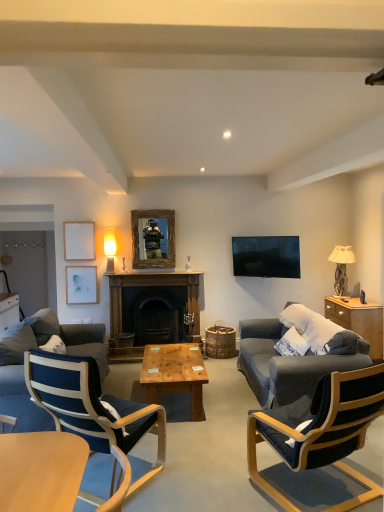
Question: Is dark blue fabric chair at right, the 2th chair positioned from the left, to the left of dark gray fabric couch at left from the viewer's perspective?

Choices:
 (A) yes
 (B) no

Answer: (B)

Question: Can you see dark blue fabric chair at right, the 2th chair positioned from the left, touching dark gray fabric couch at left?

Choices:
 (A) no
 (B) yes

Answer: (A)

Question: Is dark blue fabric chair at right, the 2th chair positioned from the left, thinner than dark gray fabric couch at left?

Choices:
 (A) yes
 (B) no

Answer: (A)

Question: Does dark blue fabric chair at right, which is the first chair in right-to-left order, turn towards dark gray fabric couch at left?

Choices:
 (A) yes
 (B) no

Answer: (B)

Question: Is dark blue fabric chair at right, which is the first chair in right-to-left order, positioned with its back to dark gray fabric couch at left?

Choices:
 (A) yes
 (B) no

Answer: (B)

Question: Is dark blue fabric chair at right, the 2th chair positioned from the left, at the right side of dark gray fabric couch at left?

Choices:
 (A) yes
 (B) no

Answer: (A)

Question: From the image's perspective, is wooden picture frame at upper left, which is the 2th picture frame in bottom-to-top order, below wooden frame mirror at center?

Choices:
 (A) no
 (B) yes

Answer: (B)

Question: Considering the relative positions of wooden picture frame at upper left, which is the 2th picture frame in bottom-to-top order, and wooden frame mirror at center in the image provided, is wooden picture frame at upper left, which is the 2th picture frame in bottom-to-top order, behind wooden frame mirror at center?

Choices:
 (A) no
 (B) yes

Answer: (B)

Question: Is wooden picture frame at upper left, which is the 2th picture frame in bottom-to-top order, at the right side of wooden frame mirror at center?

Choices:
 (A) no
 (B) yes

Answer: (A)

Question: Is wooden picture frame at upper left, which is the 2th picture frame in bottom-to-top order, at the left side of wooden frame mirror at center?

Choices:
 (A) no
 (B) yes

Answer: (B)

Question: Is wooden picture frame at upper left, which is the 2th picture frame in bottom-to-top order, bigger than wooden frame mirror at center?

Choices:
 (A) yes
 (B) no

Answer: (B)

Question: Does wooden picture frame at upper left, arranged as the first picture frame when viewed from the top, have a greater height compared to wooden frame mirror at center?

Choices:
 (A) no
 (B) yes

Answer: (A)

Question: From a real-world perspective, is blue fabric chair at lower left, which is counted as the 2th chair, starting from the right, on top of dark blue fabric chair at right, which is the first chair in right-to-left order?

Choices:
 (A) no
 (B) yes

Answer: (B)